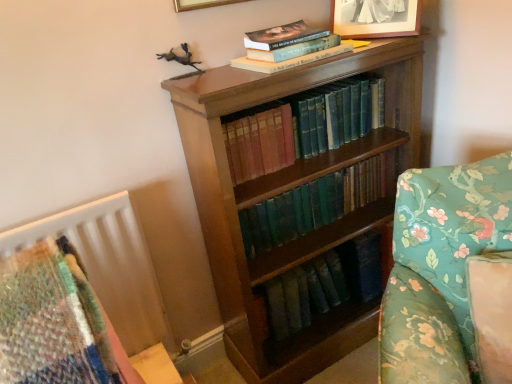
This screenshot has width=512, height=384. Identify the location of empty space that is ontop of green leather book at center, which is the 2th book from top to bottom (from a real-world perspective). (302, 94).